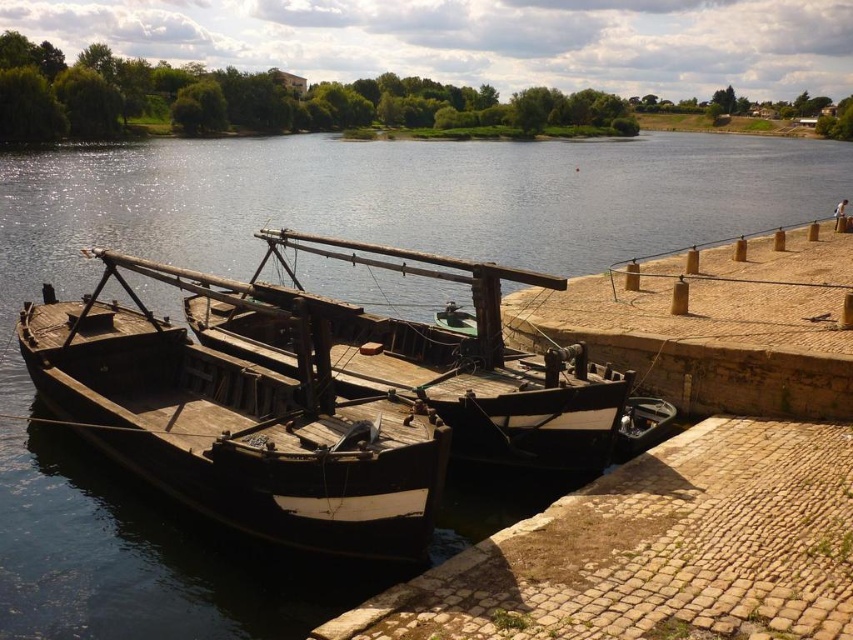
Question: Where is wooden boat at center located in relation to brown stone dock at right in the image?

Choices:
 (A) left
 (B) right

Answer: (A)

Question: Considering the relative positions of wooden boat at center and brown stone dock at right in the image provided, where is wooden boat at center located with respect to brown stone dock at right?

Choices:
 (A) below
 (B) above

Answer: (A)

Question: Which is nearer to the wooden boat at left?

Choices:
 (A) wooden boat at center
 (B) brown stone dock at right

Answer: (A)

Question: Does wooden boat at center appear over brown stone dock at right?

Choices:
 (A) yes
 (B) no

Answer: (B)

Question: Which object is farther from the camera taking this photo?

Choices:
 (A) brown stone dock at right
 (B) wooden boat at center

Answer: (A)

Question: Which point is farther from the camera taking this photo?

Choices:
 (A) (824, 292)
 (B) (473, 355)

Answer: (A)